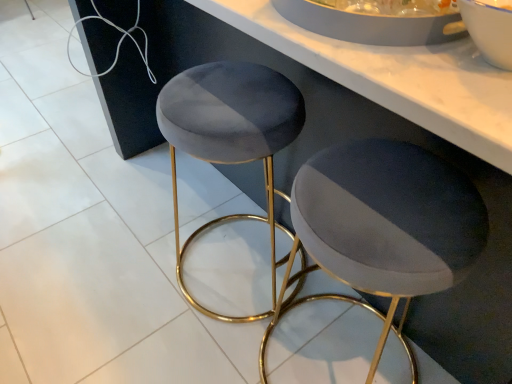
Locate an element on the screen. blank space situated above velvet grey stool at center (from a real-world perspective) is located at coordinates (388, 198).